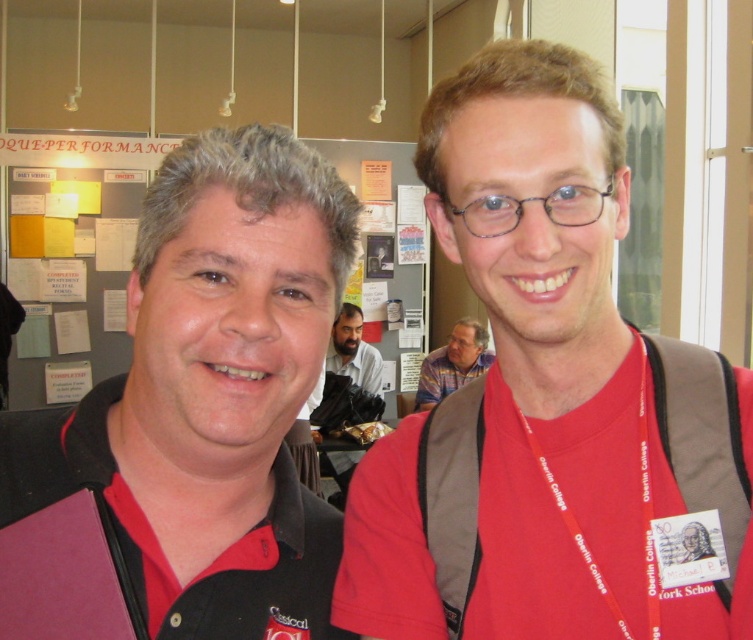
Where is the matte red shirt at center located in the image?

The matte red shirt at center is located at point (550, 403).

Based on the scene description, can you determine the spatial relationship between the matte black polo shirt at left and the bearded man at center? Specifically, which one is positioned to the right?

The matte black polo shirt at left is to the right of the bearded man at center.

You are a photographer trying to capture a clear shot of both the matte red shirt at center and the striped fabric shirt at center. Since you can only focus on one subject at a time, which shirt should you focus on to ensure the other is still somewhat in focus?

The matte red shirt at center is closer to the viewer than the striped fabric shirt at center. By focusing on the matte red shirt at center, the striped fabric shirt at center will be slightly out of focus. Alternatively, focusing on the striped fabric shirt at center would leave the closer matte red shirt at center in focus but the farther one more blurred. To have both somewhat in focus, the photographer might need to adjust the focus point between them or use a smaller aperture for greater depth of field